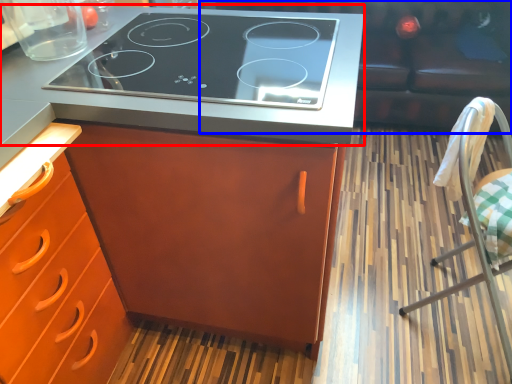
Question: Which object appears closest to the camera in this image, countertop (highlighted by a red box) or couch (highlighted by a blue box)?

Choices:
 (A) countertop
 (B) couch

Answer: (A)